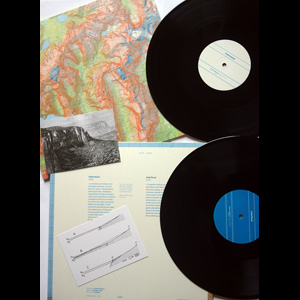
What are the coordinates of `music record discs` in the screenshot? It's located at (235, 220), (221, 75).